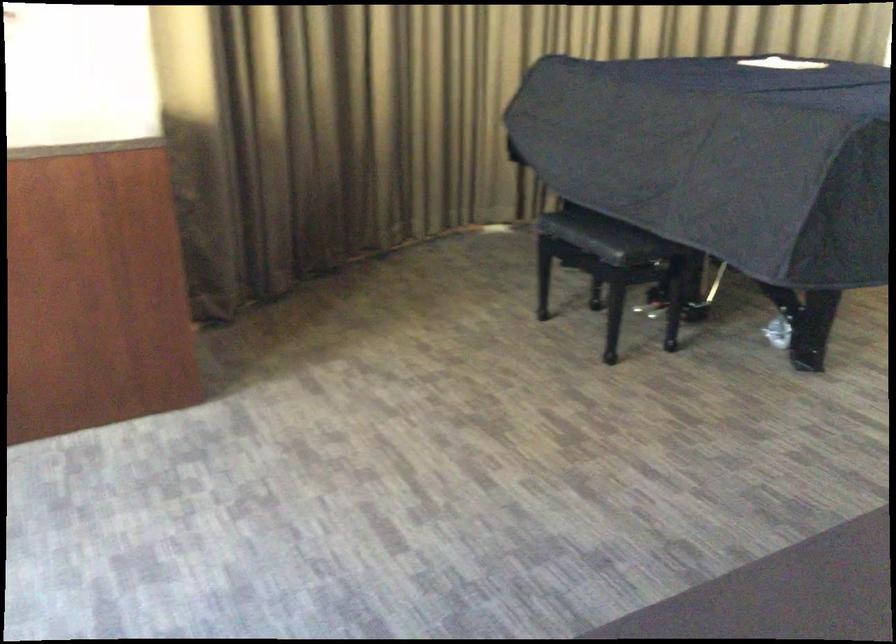
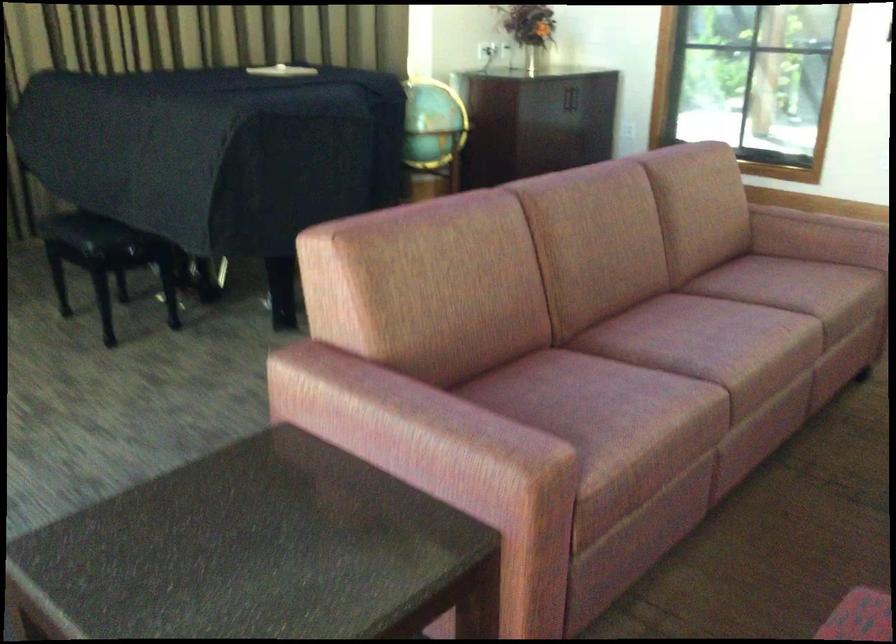
What movement of the cameraman would produce the second image?

The cameraman walked toward right, backward.